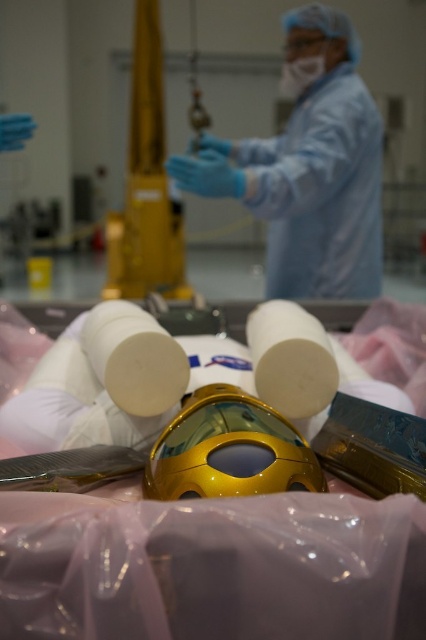
You are an engineer in a laboratory and need to place both the metallic gold helmet at center and the white matte toilet paper at center into a storage container. The container can only hold items that take up the same amount of space. Can both items fit into the container?

The metallic gold helmet at center occupies less space than the white matte toilet paper at center, so they do not take up the same amount of space. Therefore, both items cannot fit into the container.